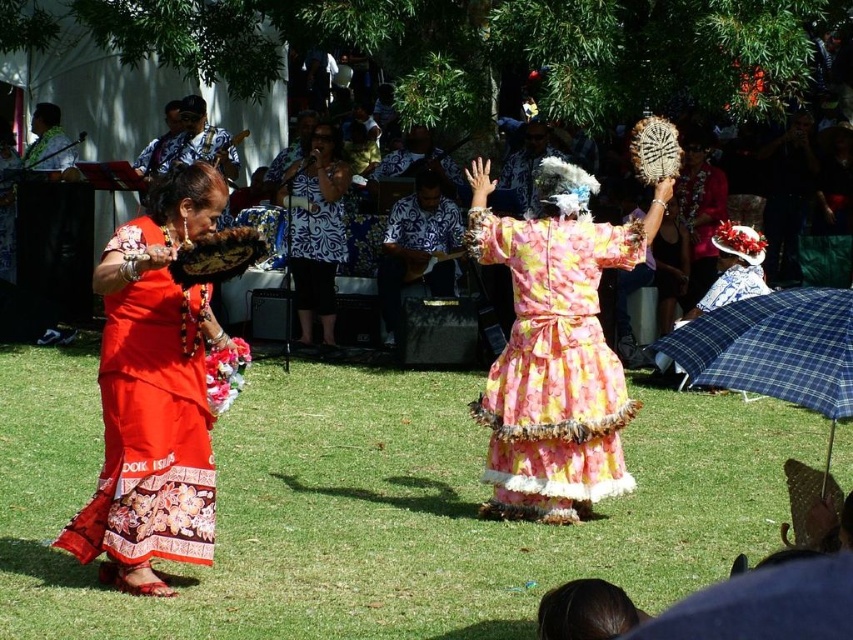
Which of these two, green grass at lower center or blue plaid umbrella at lower right, stands taller?

blue plaid umbrella at lower right

Is green grass at lower center shorter than blue plaid umbrella at lower right?

Correct, green grass at lower center is not as tall as blue plaid umbrella at lower right.

Between point (374, 592) and point (848, 316), which one is positioned behind?

Positioned behind is point (374, 592).

Identify the location of green grass at lower center. The image size is (853, 640). (379, 508).

Does floral chiffon dress at center appear over patterned fabric shirt at center?

Actually, floral chiffon dress at center is below patterned fabric shirt at center.

Between floral chiffon dress at center and patterned fabric shirt at center, which one is positioned higher?

patterned fabric shirt at center

The width and height of the screenshot is (853, 640). Describe the element at coordinates (554, 364) in the screenshot. I see `floral chiffon dress at center` at that location.

The image size is (853, 640). I want to click on floral chiffon dress at center, so click(x=554, y=364).

Where is `green grass at lower center`? This screenshot has height=640, width=853. green grass at lower center is located at coordinates (379, 508).

Can you confirm if green grass at lower center is positioned to the right of floral chiffon dress at center?

Incorrect, green grass at lower center is not on the right side of floral chiffon dress at center.

Where is `green grass at lower center`? This screenshot has height=640, width=853. green grass at lower center is located at coordinates (379, 508).

At what (x,y) coordinates should I click in order to perform the action: click on green grass at lower center. Please return your answer as a coordinate pair (x, y). The height and width of the screenshot is (640, 853). Looking at the image, I should click on (379, 508).